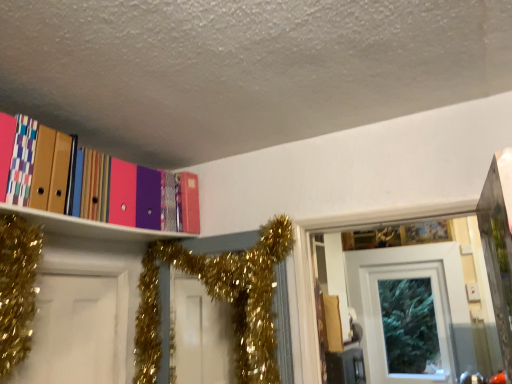
Where is `gold glitter garland at upper center`? gold glitter garland at upper center is located at coordinates (220, 299).

What do you see at coordinates (89, 226) in the screenshot?
I see `matte plastic folders at upper left` at bounding box center [89, 226].

Where is `gold glitter garland at upper center`? The image size is (512, 384). gold glitter garland at upper center is located at coordinates (220, 299).

You are a GUI agent. You are given a task and a screenshot of the screen. Output one action in this format:
    pyautogui.click(x=<x>, y=<y>)
    Task: Click on the christmas decoration above the white glossy door at upper center (from a real-world perspective)
    
    Given the screenshot: What is the action you would take?
    pyautogui.click(x=220, y=299)

Is white glossy door at upper center bigger or smaller than gold glitter garland at upper center?

In the image, white glossy door at upper center appears to be smaller than gold glitter garland at upper center.

Considering the sizes of white glossy door at upper center and gold glitter garland at upper center in the image, is white glossy door at upper center wider or thinner than gold glitter garland at upper center?

Considering their sizes, white glossy door at upper center looks slimmer than gold glitter garland at upper center.

Is gold glitter garland at upper center looking in the opposite direction of white glossy door at upper center?

Yes.

From the image's perspective, is gold glitter garland at upper center located above white glossy door at upper center?

Correct, gold glitter garland at upper center appears higher than white glossy door at upper center in the image.

Find the location of a particular element. The height and width of the screenshot is (384, 512). christmas decoration above the white glossy door at upper center (from a real-world perspective) is located at coordinates (220, 299).

Which is more to the right, gold glitter garland at upper center or white glossy door at upper center?

From the viewer's perspective, white glossy door at upper center appears more on the right side.

From a real-world perspective, which is physically above, gold glitter garland at upper center or matte plastic folders at upper left?

matte plastic folders at upper left is physically above.

Is gold glitter garland at upper center positioned with its back to matte plastic folders at upper left?

No, matte plastic folders at upper left is not at the back of gold glitter garland at upper center.

Would you say gold glitter garland at upper center is a long distance from matte plastic folders at upper left?

No, gold glitter garland at upper center is not far from matte plastic folders at upper left.

Considering the relative positions of matte plastic folders at upper left and white glossy door at upper center in the image provided, is matte plastic folders at upper left to the left of white glossy door at upper center from the viewer's perspective?

Yes.

How distant is matte plastic folders at upper left from white glossy door at upper center?

matte plastic folders at upper left is 2.82 meters away from white glossy door at upper center.

Are matte plastic folders at upper left and white glossy door at upper center located far from each other?

Yes, matte plastic folders at upper left and white glossy door at upper center are quite far apart.

What's the angular difference between white glossy door at upper center and matte plastic folders at upper left's facing directions?

The facing directions of white glossy door at upper center and matte plastic folders at upper left are 90.2 degrees apart.

Considering the sizes of objects white glossy door at upper center and matte plastic folders at upper left in the image provided, who is wider, white glossy door at upper center or matte plastic folders at upper left?

matte plastic folders at upper left.

From a real-world perspective, is white glossy door at upper center positioned over matte plastic folders at upper left based on gravity?

No, from a real-world perspective, white glossy door at upper center is not on top of matte plastic folders at upper left.

Where is `shelf in front of the white glossy door at upper center`? shelf in front of the white glossy door at upper center is located at coordinates (89, 226).

Does point (62, 217) come in front of point (264, 296)?

Yes, it is in front of point (264, 296).

Which object is closer to the camera, matte plastic folders at upper left or gold glitter garland at upper center?

matte plastic folders at upper left.

From the image's perspective, which one is positioned lower, matte plastic folders at upper left or gold glitter garland at upper center?

From the image's view, gold glitter garland at upper center is below.

Is matte plastic folders at upper left looking in the opposite direction of gold glitter garland at upper center?

That's not correct — matte plastic folders at upper left is not looking away from gold glitter garland at upper center.

The width and height of the screenshot is (512, 384). Find the location of `door lying on the right of gold glitter garland at upper center`. door lying on the right of gold glitter garland at upper center is located at coordinates pos(411,312).

At what (x,y) coordinates should I click in order to perform the action: click on christmas decoration above the white glossy door at upper center (from the image's perspective). Please return your answer as a coordinate pair (x, y). Looking at the image, I should click on (220, 299).

Based on their spatial positions, is matte plastic folders at upper left or white glossy door at upper center closer to gold glitter garland at upper center?

matte plastic folders at upper left is closer to gold glitter garland at upper center.

Looking at the image, which one is located closer to white glossy door at upper center, matte plastic folders at upper left or gold glitter garland at upper center?

gold glitter garland at upper center lies closer to white glossy door at upper center than the other object.

When comparing their distances from matte plastic folders at upper left, does gold glitter garland at upper center or white glossy door at upper center seem further?

The object further to matte plastic folders at upper left is white glossy door at upper center.

When comparing their distances from matte plastic folders at upper left, does white glossy door at upper center or gold glitter garland at upper center seem closer?

gold glitter garland at upper center is closer to matte plastic folders at upper left.

Which object lies nearer to the anchor point white glossy door at upper center, gold glitter garland at upper center or matte plastic folders at upper left?

gold glitter garland at upper center is closer to white glossy door at upper center.

Considering their positions, is white glossy door at upper center positioned closer to gold glitter garland at upper center than matte plastic folders at upper left?

The object closer to gold glitter garland at upper center is matte plastic folders at upper left.

This screenshot has width=512, height=384. I want to click on christmas decoration between matte plastic folders at upper left and white glossy door at upper center along the z-axis, so click(220, 299).